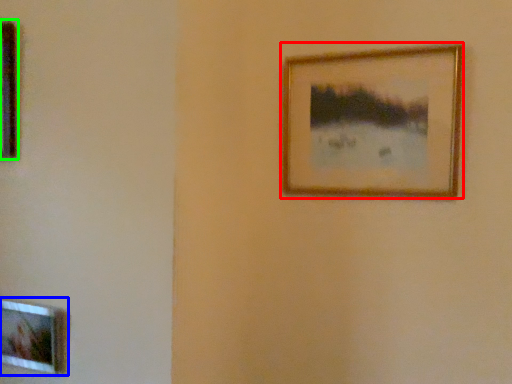
Question: Which is nearer to the picture frame (highlighted by a red box)? picture frame (highlighted by a blue box) or picture frame (highlighted by a green box).

Choices:
 (A) picture frame
 (B) picture frame

Answer: (B)